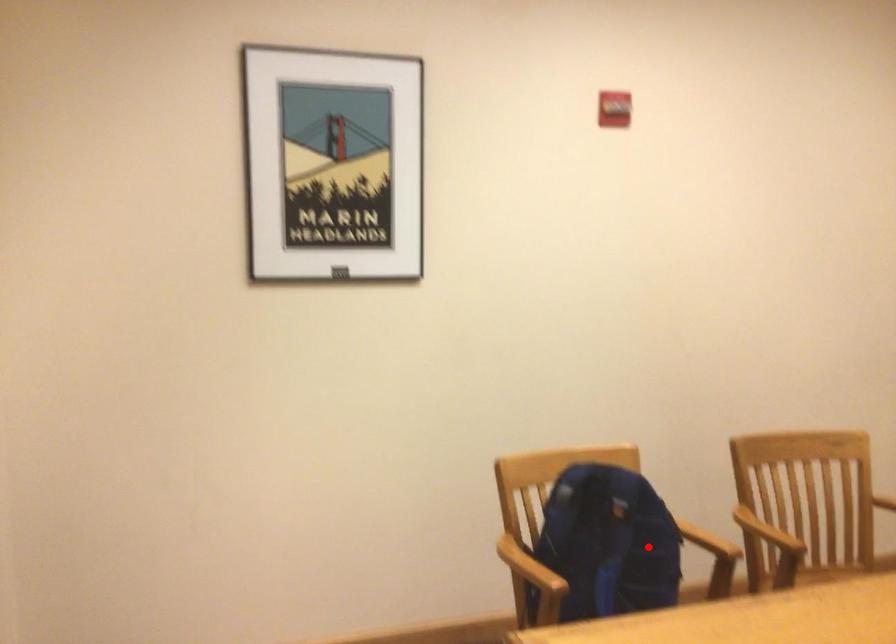
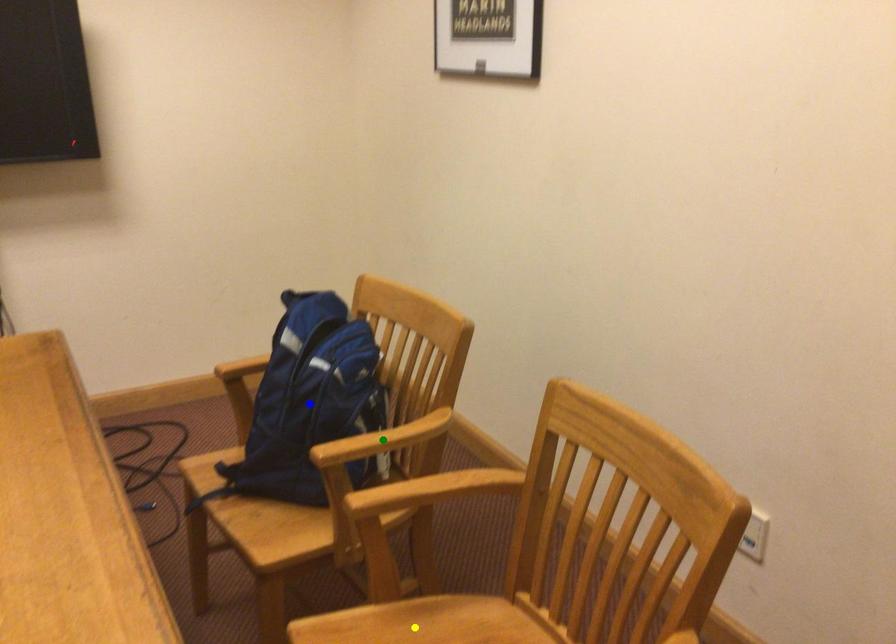
Question: I am providing you with two images of the same scene from different viewpoints. A red point is marked on the first image. You are given multiple points on the second image. In image 2, which mark is for the same physical point as the one in image 1?

Choices:
 (A) yellow point
 (B) green point
 (C) blue point

Answer: (C)